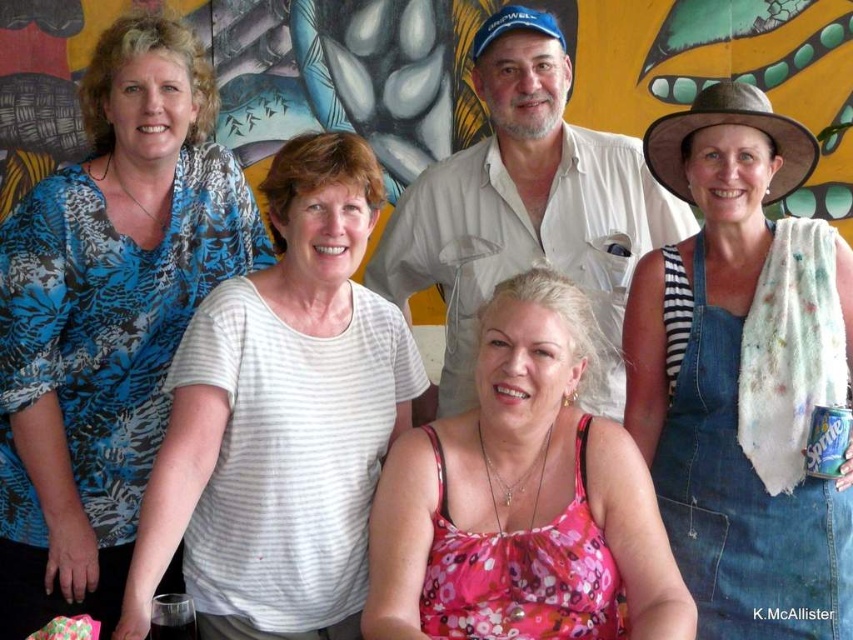
Question: Can you confirm if blue printed blouse at upper left is thinner than pink floral tank top at center?

Choices:
 (A) no
 (B) yes

Answer: (B)

Question: Is blue printed blouse at upper left behind white striped shirt at upper left?

Choices:
 (A) yes
 (B) no

Answer: (A)

Question: Which of the following is the farthest from the observer?

Choices:
 (A) (747, 614)
 (B) (576, 618)

Answer: (A)

Question: Which point is closer to the camera?

Choices:
 (A) pink floral tank top at center
 (B) blue printed blouse at upper left
 (C) white striped shirt at upper left

Answer: (C)

Question: Observing the image, what is the correct spatial positioning of blue printed blouse at upper left in reference to floral fabric dress at center?

Choices:
 (A) right
 (B) left

Answer: (B)

Question: Which point appears farthest from the camera in this image?

Choices:
 (A) (215, 436)
 (B) (590, 570)

Answer: (A)